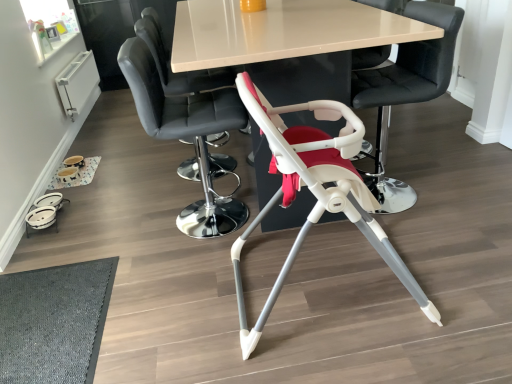
This screenshot has width=512, height=384. Find the location of `vacant space in white plastic highchair at center, placed as the second chair when sorted from right to left (from a real-world perspective)`. vacant space in white plastic highchair at center, placed as the second chair when sorted from right to left (from a real-world perspective) is located at coordinates (327, 284).